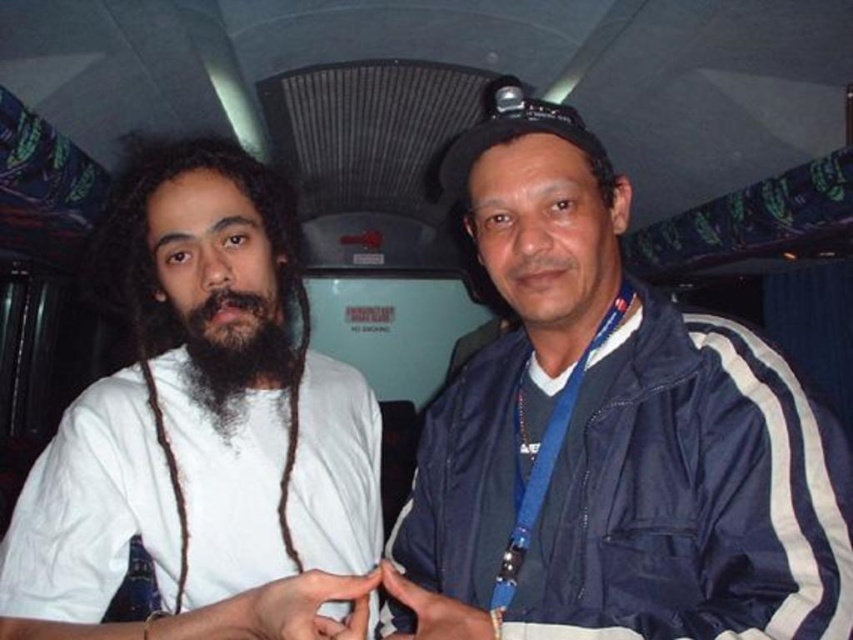
You are a passenger on a bus and you see the blue fabric jacket at right and the black fuzzy beard at center. Which object is located higher in the image?

The blue fabric jacket at right is above the black fuzzy beard at center, so the blue fabric jacket at right is higher in the image.

You are standing in front of the bus interior shown in the image. You need to locate the blue fabric jacket at right. Where would you look relative to the center of the image?

The blue fabric jacket at right is located at the coordinates 0.681 on the x axis and 0.719 on the y axis, which is to the right and slightly above the center of the image.

You are a photographer trying to capture a photo of both the blue fabric jacket at right and the white matte shirt at left in the same frame. Based on their heights, which object should you focus on first to ensure both are fully visible in the photo?

The blue fabric jacket at right is taller than the white matte shirt at left. To ensure both are fully visible, focus on framing the taller blue fabric jacket at right first, then adjust the camera angle to include the shorter white matte shirt at left.